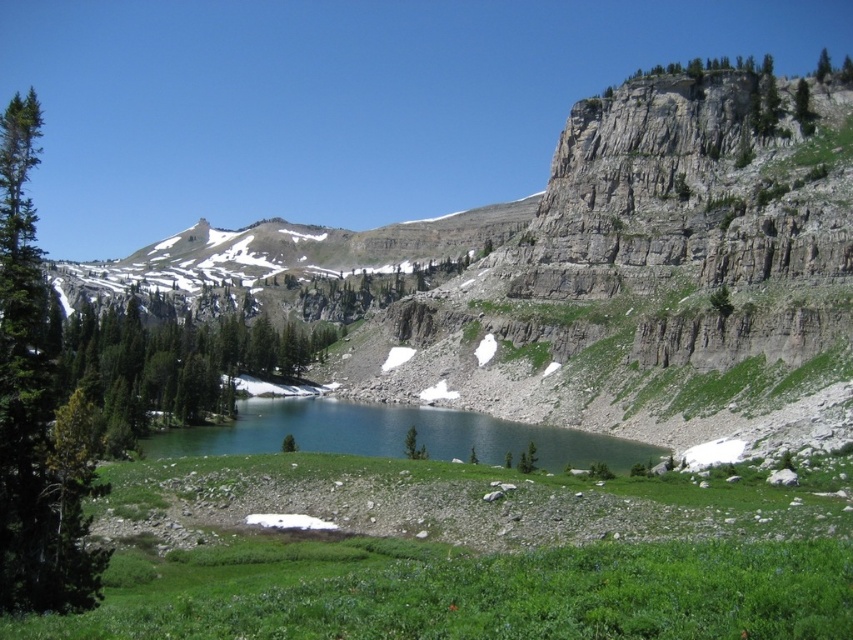
Which is in front, point (28, 509) or point (210, 388)?

Point (28, 509)

Is green textured tree at left thinner than green leafy tree at center?

Incorrect, green textured tree at left's width is not less than green leafy tree at center's.

Who is more distant from viewer, (9,141) or (294,355)?

Point (294,355)

The image size is (853, 640). I want to click on green textured tree at left, so click(35, 410).

Based on the photo, is green textured tree at left closer to the viewer compared to green textured tree at upper right?

That is True.

Can you confirm if green textured tree at left is bigger than green textured tree at upper right?

Yes, green textured tree at left is bigger than green textured tree at upper right.

The width and height of the screenshot is (853, 640). I want to click on green textured tree at left, so click(x=35, y=410).

Can you confirm if green textured tree at left is positioned to the left of green grassy mountain lake at center?

Yes, green textured tree at left is to the left of green grassy mountain lake at center.

Based on the photo, who is positioned more to the right, green textured tree at left or green grassy mountain lake at center?

Positioned to the right is green grassy mountain lake at center.

Is point (35, 474) positioned after point (219, 445)?

No.

You are a GUI agent. You are given a task and a screenshot of the screen. Output one action in this format:
    pyautogui.click(x=<x>, y=<y>)
    Task: Click on the green textured tree at left
    
    Given the screenshot: What is the action you would take?
    pyautogui.click(x=35, y=410)